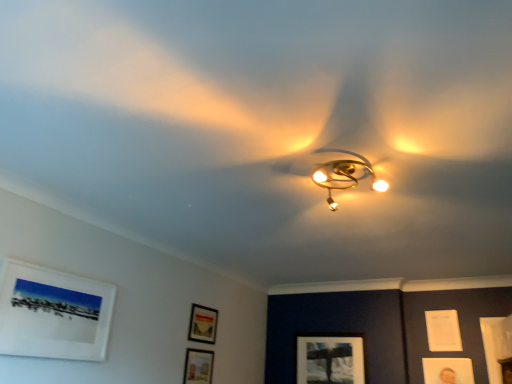
Question: Is matte white picture frame at lower center, which is the 4th picture frame in left-to-right order, shorter than white matte picture frame at upper left, which is the 6th picture frame in back-to-front order?

Choices:
 (A) yes
 (B) no

Answer: (A)

Question: Is matte white picture frame at lower center, acting as the 1th picture frame starting from the back, not inside white matte picture frame at upper left, placed as the 6th picture frame when sorted from right to left?

Choices:
 (A) yes
 (B) no

Answer: (A)

Question: From the image's perspective, is matte white picture frame at lower center, the 6th picture frame positioned from the front, on top of white matte picture frame at upper left, the first picture frame from the left?

Choices:
 (A) yes
 (B) no

Answer: (B)

Question: Is matte white picture frame at lower center, which is the third picture frame from right to left, bigger than white matte picture frame at upper left, placed as the first picture frame when sorted from front to back?

Choices:
 (A) no
 (B) yes

Answer: (A)

Question: Is matte white picture frame at lower center, acting as the 1th picture frame starting from the back, smaller than white matte picture frame at upper left, which is the 6th picture frame in back-to-front order?

Choices:
 (A) no
 (B) yes

Answer: (B)

Question: From the image's perspective, relative to white paper at upper right, which is the sixth picture frame from left to right, is matte black picture frame at lower center, which is the fourth picture frame in right-to-left order, above or below?

Choices:
 (A) above
 (B) below

Answer: (A)

Question: From a real-world perspective, relative to white paper at upper right, the 1th picture frame from the right, is matte black picture frame at lower center, acting as the 3th picture frame starting from the left, vertically above or below?

Choices:
 (A) above
 (B) below

Answer: (B)

Question: Do you think matte black picture frame at lower center, the fourth picture frame in the back-to-front sequence, is within white paper at upper right, which appears as the fifth picture frame when viewed from the front, or outside of it?

Choices:
 (A) outside
 (B) inside

Answer: (A)

Question: Considering the positions of matte black picture frame at lower center, acting as the 3th picture frame starting from the left, and white paper at upper right, which appears as the fifth picture frame when viewed from the front, in the image, is matte black picture frame at lower center, acting as the 3th picture frame starting from the left, wider or thinner than white paper at upper right, which appears as the fifth picture frame when viewed from the front,?

Choices:
 (A) thin
 (B) wide

Answer: (A)

Question: Do you think matte black picture frame at lower center, which is the fourth picture frame in right-to-left order, is within matte gold picture frame at lower right, positioned as the second picture frame in right-to-left order, or outside of it?

Choices:
 (A) outside
 (B) inside

Answer: (A)

Question: Considering the positions of matte black picture frame at lower center, which is the fourth picture frame in right-to-left order, and matte gold picture frame at lower right, placed as the fifth picture frame when sorted from left to right, in the image, is matte black picture frame at lower center, which is the fourth picture frame in right-to-left order, taller or shorter than matte gold picture frame at lower right, placed as the fifth picture frame when sorted from left to right,?

Choices:
 (A) short
 (B) tall

Answer: (B)

Question: From the image's perspective, is matte black picture frame at lower center, acting as the 3th picture frame starting from the left, located above or below matte gold picture frame at lower right, placed as the fifth picture frame when sorted from left to right?

Choices:
 (A) above
 (B) below

Answer: (A)

Question: In terms of width, does matte black picture frame at lower center, which is the fourth picture frame in right-to-left order, look wider or thinner when compared to matte gold picture frame at lower right, the 3th picture frame when ordered from back to front?

Choices:
 (A) wide
 (B) thin

Answer: (B)

Question: From the image's perspective, is matte black picture frame at lower center, which is counted as the 2th picture frame, starting from the left, above or below matte gold picture frame at lower right, the 3th picture frame when ordered from back to front?

Choices:
 (A) above
 (B) below

Answer: (A)

Question: Do you think matte black picture frame at lower center, which is counted as the 2th picture frame, starting from the left, is within matte gold picture frame at lower right, which is the 4th picture frame from front to back, or outside of it?

Choices:
 (A) inside
 (B) outside

Answer: (B)